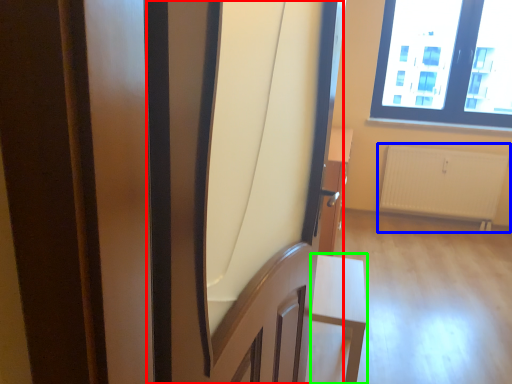
Question: Which object is positioned closest to screen door (highlighted by a red box)? Select from radiator (highlighted by a blue box) and furniture (highlighted by a green box).

Choices:
 (A) radiator
 (B) furniture

Answer: (B)